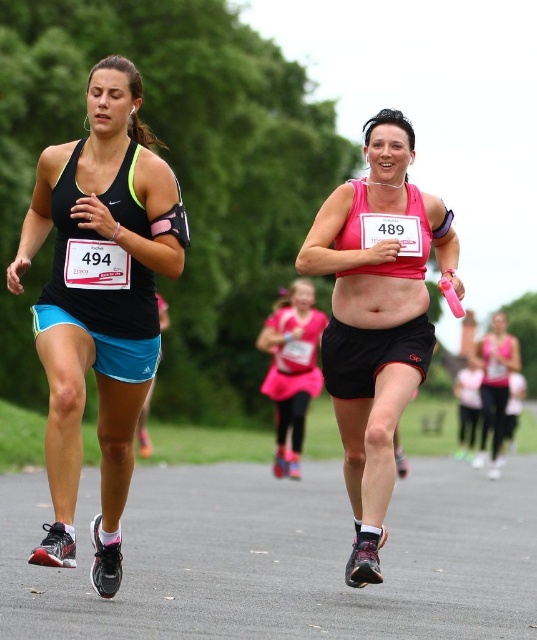
Question: Among these points, which one is farthest from the camera?

Choices:
 (A) (500, 310)
 (B) (383, 152)
 (C) (262, 344)
 (D) (76, 474)

Answer: (A)

Question: Does pink fabric skirt at center appear on the left side of matte pink belly at center?

Choices:
 (A) no
 (B) yes

Answer: (B)

Question: Which point is closer to the camera?

Choices:
 (A) pink matte tank top at right
 (B) matte pink belly at center

Answer: (B)

Question: Which of these objects is positioned closest to the pink fabric skirt at center?

Choices:
 (A) black matte tank top at left
 (B) pink matte tank top at center
 (C) pink matte tank top at right

Answer: (C)

Question: Is black matte tank top at left further to the viewer compared to matte pink belly at center?

Choices:
 (A) no
 (B) yes

Answer: (A)

Question: Is pink matte tank top at center wider than matte pink belly at center?

Choices:
 (A) yes
 (B) no

Answer: (A)